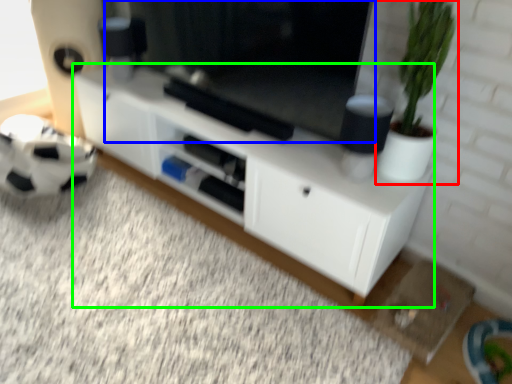
Question: Estimate the real-world distances between objects in this image. Which object is farther from houseplant (highlighted by a red box), window screen (highlighted by a blue box) or cabinetry (highlighted by a green box)?

Choices:
 (A) window screen
 (B) cabinetry

Answer: (B)